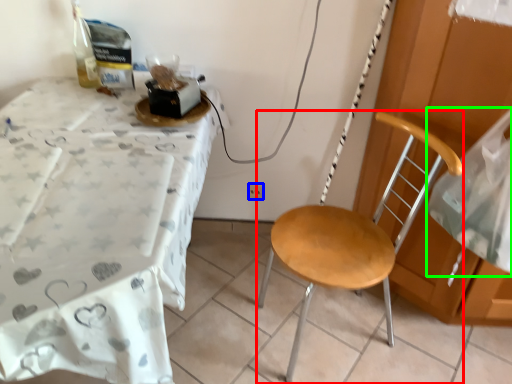
Question: Based on their relative distances, which object is nearer to chair (highlighted by a red box)? Choose from power outlet (highlighted by a blue box) and sheet (highlighted by a green box).

Choices:
 (A) power outlet
 (B) sheet

Answer: (B)